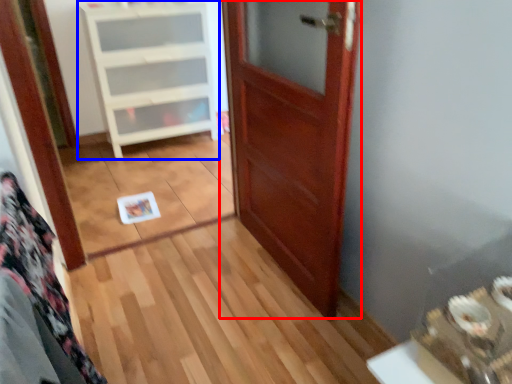
Question: Which of the following is the farthest to the observer, door (highlighted by a red box) or cabinetry (highlighted by a blue box)?

Choices:
 (A) door
 (B) cabinetry

Answer: (B)